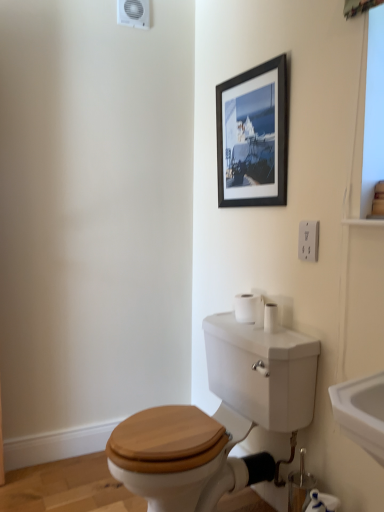
Question: Can you confirm if white matte toilet paper at lower right, the second toilet paper positioned from the top, is shorter than white plastic electrical outlet at upper right?

Choices:
 (A) yes
 (B) no

Answer: (B)

Question: Is white matte toilet paper at lower right, arranged as the 1th toilet paper when viewed from the right, behind white plastic electrical outlet at upper right?

Choices:
 (A) no
 (B) yes

Answer: (A)

Question: From a real-world perspective, is white matte toilet paper at lower right, arranged as the 1th toilet paper when viewed from the right, beneath white plastic electrical outlet at upper right?

Choices:
 (A) yes
 (B) no

Answer: (A)

Question: Is the depth of white matte toilet paper at lower right, which ranks as the 1th toilet paper in bottom-to-top order, less than that of white plastic electrical outlet at upper right?

Choices:
 (A) no
 (B) yes

Answer: (B)

Question: Could you tell me if white matte toilet paper at lower right, the 1th toilet paper in the front-to-back sequence, is turned towards white plastic electrical outlet at upper right?

Choices:
 (A) yes
 (B) no

Answer: (B)

Question: Considering the positions of point (168, 506) and point (307, 497), is point (168, 506) closer or farther from the camera than point (307, 497)?

Choices:
 (A) closer
 (B) farther

Answer: (A)

Question: Is wooden toilet seat at center bigger or smaller than white matte toilet paper at lower right, arranged as the 1th toilet paper when viewed from the right?

Choices:
 (A) small
 (B) big

Answer: (B)

Question: Considering the positions of wooden toilet seat at center and white matte toilet paper at lower right, the 2th toilet paper viewed from the left, in the image, is wooden toilet seat at center wider or thinner than white matte toilet paper at lower right, the 2th toilet paper viewed from the left,?

Choices:
 (A) wide
 (B) thin

Answer: (A)

Question: From the image's perspective, is wooden toilet seat at center positioned above or below white matte toilet paper at lower right, the 2th toilet paper when ordered from back to front?

Choices:
 (A) below
 (B) above

Answer: (B)

Question: From the image's perspective, is white glossy sink at lower right positioned above or below wooden toilet seat at center?

Choices:
 (A) above
 (B) below

Answer: (A)

Question: Relative to wooden toilet seat at center, is white glossy sink at lower right in front or behind?

Choices:
 (A) behind
 (B) front

Answer: (B)

Question: Considering the relative positions of white glossy sink at lower right and wooden toilet seat at center in the image provided, is white glossy sink at lower right to the left or to the right of wooden toilet seat at center?

Choices:
 (A) left
 (B) right

Answer: (B)

Question: Is white glossy sink at lower right inside the boundaries of wooden toilet seat at center, or outside?

Choices:
 (A) inside
 (B) outside

Answer: (B)

Question: Do you think white matte toilet paper at lower right, the second toilet paper positioned from the top, is within white matte toilet paper at right, which is the first toilet paper in back-to-front order, or outside of it?

Choices:
 (A) outside
 (B) inside

Answer: (A)

Question: In the image, is white matte toilet paper at lower right, the 2th toilet paper viewed from the left, positioned in front of or behind white matte toilet paper at right, the second toilet paper when ordered from right to left?

Choices:
 (A) behind
 (B) front

Answer: (B)